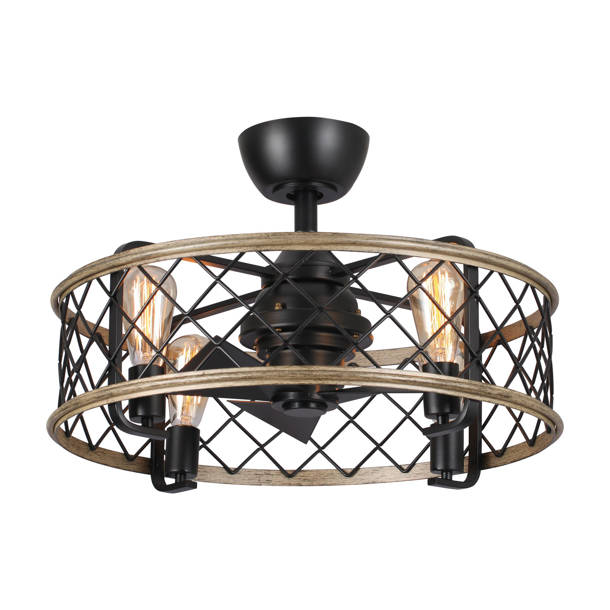
Image resolution: width=610 pixels, height=610 pixels. In order to click on wooden frame in this screenshot , I will do `click(334, 240)`, `click(312, 376)`.